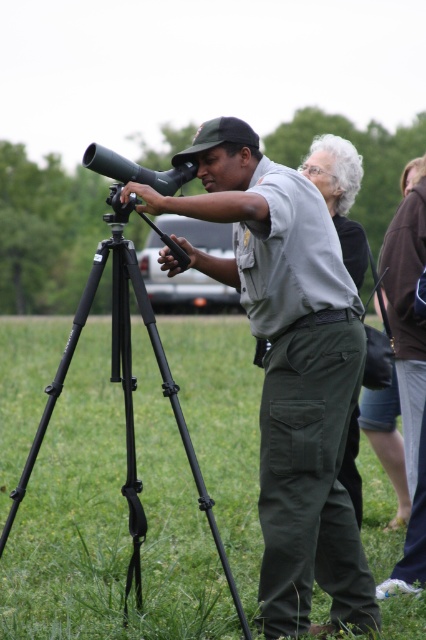
What are the coordinates of the matte gray uniform at center?

The coordinates of the matte gray uniform at center are at point (x=287, y=368).

You are a park visitor trying to determine if the matte gray uniform at center and the black metal tripod at left can fit side by side in a storage locker that is 1.2 meters wide. Based on their sizes, will they both fit?

The matte gray uniform at center is wider than the black metal tripod at left. Since the locker is 1.2 meters wide, but we don not know the exact widths of both items, we cannot determine if they will fit together.